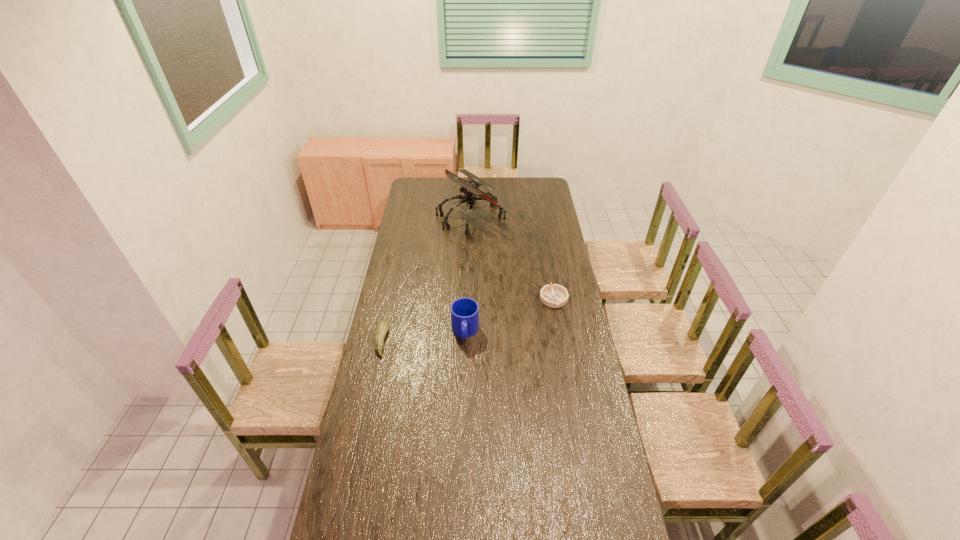
The height and width of the screenshot is (540, 960). Identify the location of the farthest object. (470, 188).

Locate an element on the screen. The image size is (960, 540). the tallest object is located at coordinates (470, 188).

Locate an element on the screen. the second tallest object is located at coordinates (464, 311).

You are a GUI agent. You are given a task and a screenshot of the screen. Output one action in this format:
    pyautogui.click(x=<x>, y=<y>)
    Task: Click on the third tallest object
    This screenshot has width=960, height=540.
    Given the screenshot: What is the action you would take?
    pyautogui.click(x=382, y=327)

Locate an element on the screen. Image resolution: width=960 pixels, height=540 pixels. the leftmost object is located at coordinates (382, 327).

You are a GUI agent. You are given a task and a screenshot of the screen. Output one action in this format:
    pyautogui.click(x=<x>, y=<y>)
    Task: Click on the second farthest object
    Image resolution: width=960 pixels, height=540 pixels.
    Given the screenshot: What is the action you would take?
    pyautogui.click(x=555, y=296)

Locate an element on the screen. The image size is (960, 540). the rightmost object is located at coordinates (555, 296).

Image resolution: width=960 pixels, height=540 pixels. I want to click on free location located 0.160m on the back of the tallest object, so click(471, 185).

Find the location of a particular element. Image resolution: width=960 pixels, height=540 pixels. free space located on the side with the handle of the third shortest object is located at coordinates (464, 361).

Where is `vacant space located 0.190m at the stem end of the third tallest object`? Image resolution: width=960 pixels, height=540 pixels. vacant space located 0.190m at the stem end of the third tallest object is located at coordinates (431, 341).